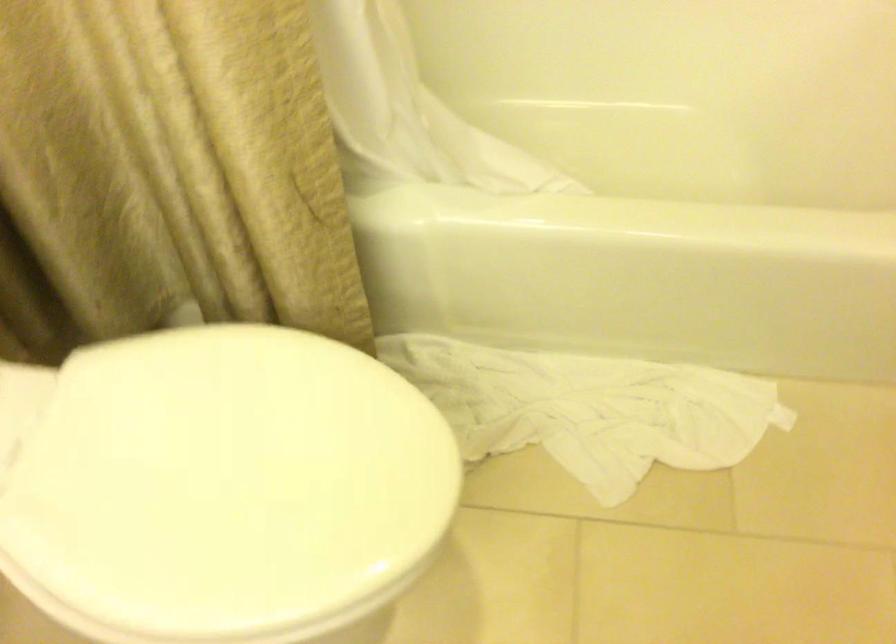
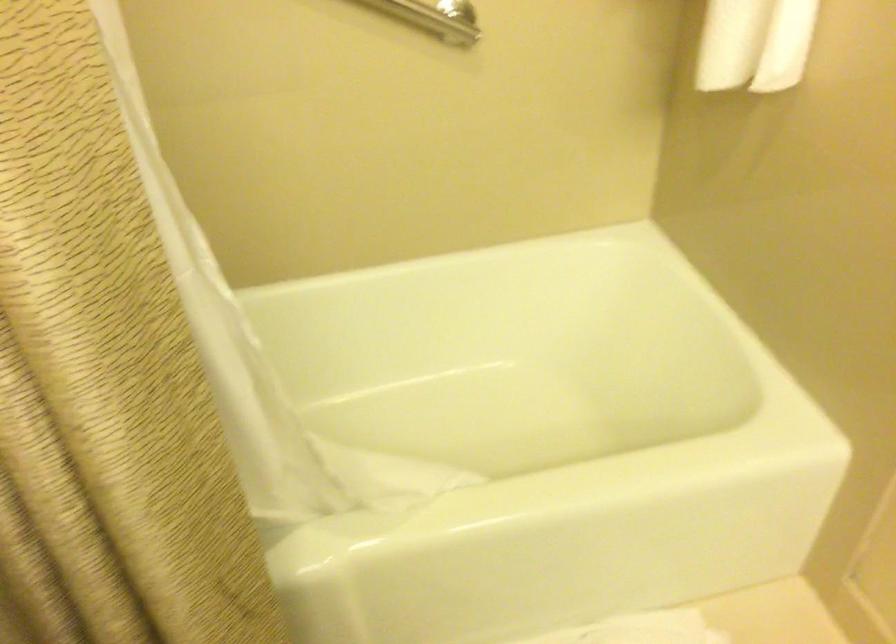
Question: The images are taken continuously from a first-person perspective. In which direction are you moving?

Choices:
 (A) Left
 (B) Right
 (C) Forward
 (D) Backward

Answer: (A)